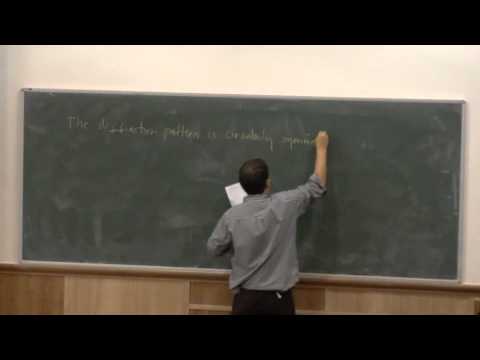
Where is `blackboard`? This screenshot has width=480, height=360. blackboard is located at coordinates (384, 233).